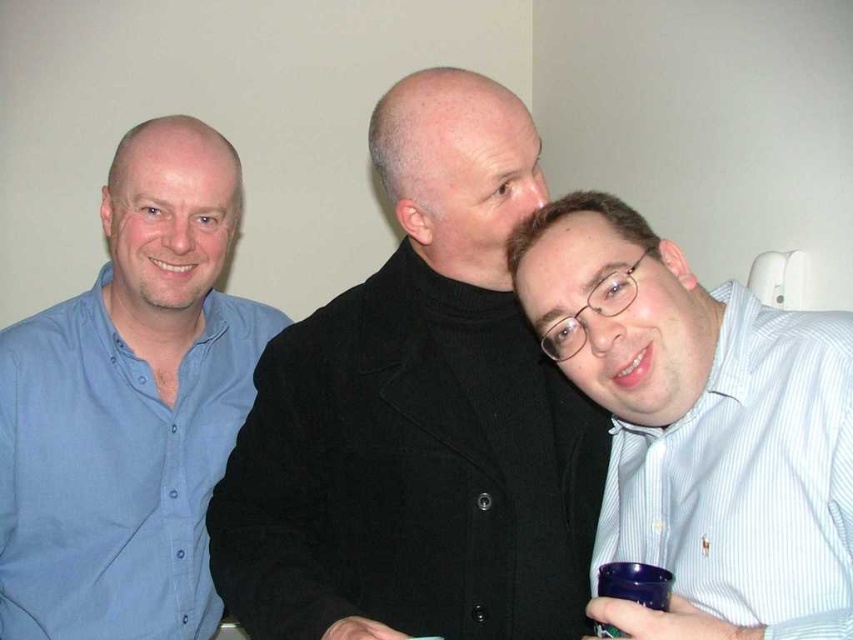
In the scene described, there are two objects present. The first is a blue cotton shirt at left, and the second is a blue plastic cup at lower right. Based on their positions, which object is located more to the left side of the image?

The blue cotton shirt at left is positioned more to the left than the blue plastic cup at lower right.

In the scene shown: You are a photographer trying to capture a candid shot of the blue cotton shirt at left and the blue plastic cup at lower right. Since you want to ensure both are in focus, you need to know their relative sizes. Which object is taller?

The blue cotton shirt at left is taller than the blue plastic cup at lower right according to the description.